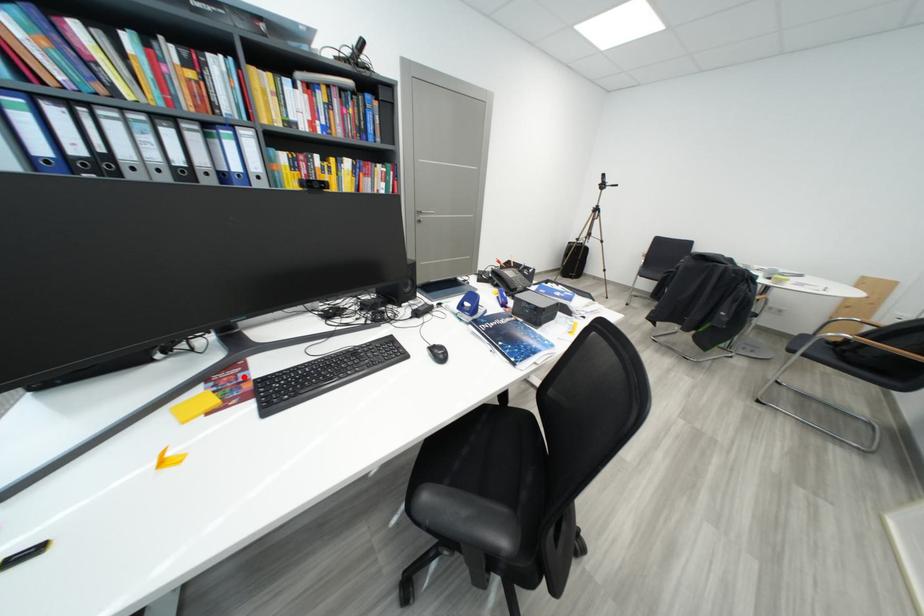
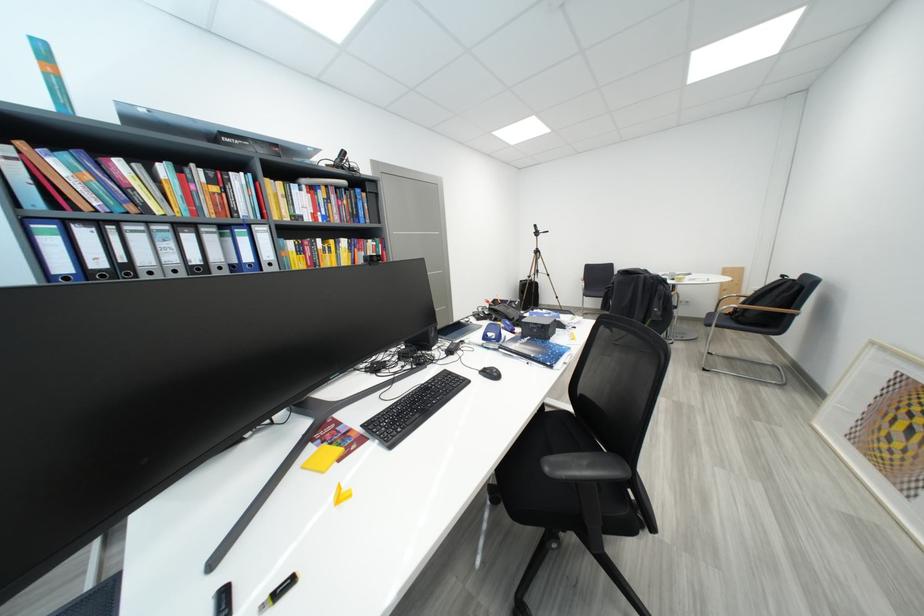
Find the pixel in the second image that matches the highlighted location in the first image.

(343, 432)